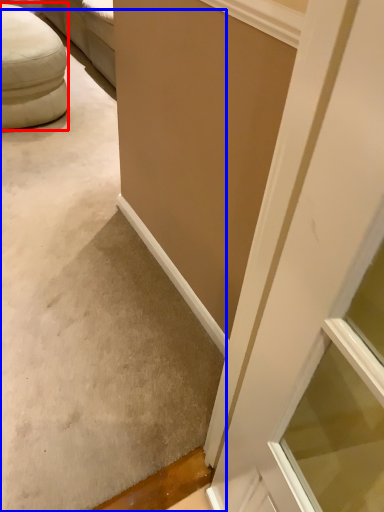
Question: Among these objects, which one is farthest to the camera, furniture (highlighted by a red box) or concrete (highlighted by a blue box)?

Choices:
 (A) furniture
 (B) concrete

Answer: (A)